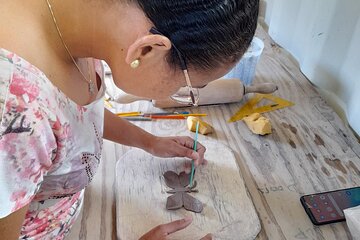
Identify the location of wall. (331, 43).